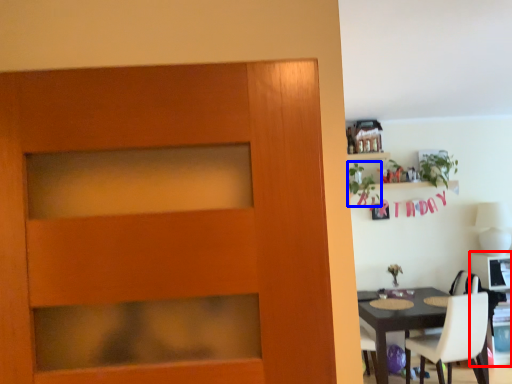
Question: Which point is further to the camera, computer desk (highlighted by a red box) or plant (highlighted by a blue box)?

Choices:
 (A) computer desk
 (B) plant

Answer: (A)